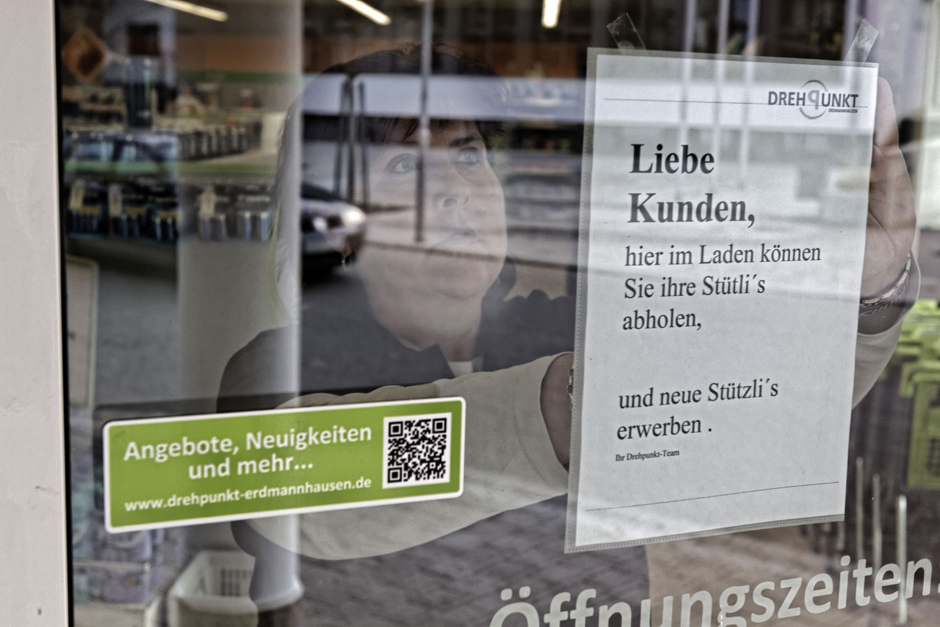
This screenshot has width=940, height=627. What are the coordinates of `window` in the screenshot? It's located at (x=265, y=266), (x=515, y=554).